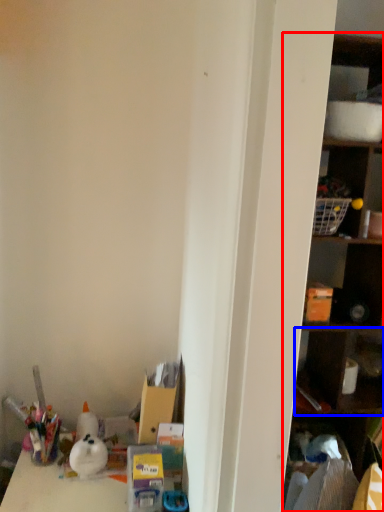
Question: Which of the following is the closest to the observer, shelf (highlighted by a red box) or cabinet (highlighted by a blue box)?

Choices:
 (A) shelf
 (B) cabinet

Answer: (A)